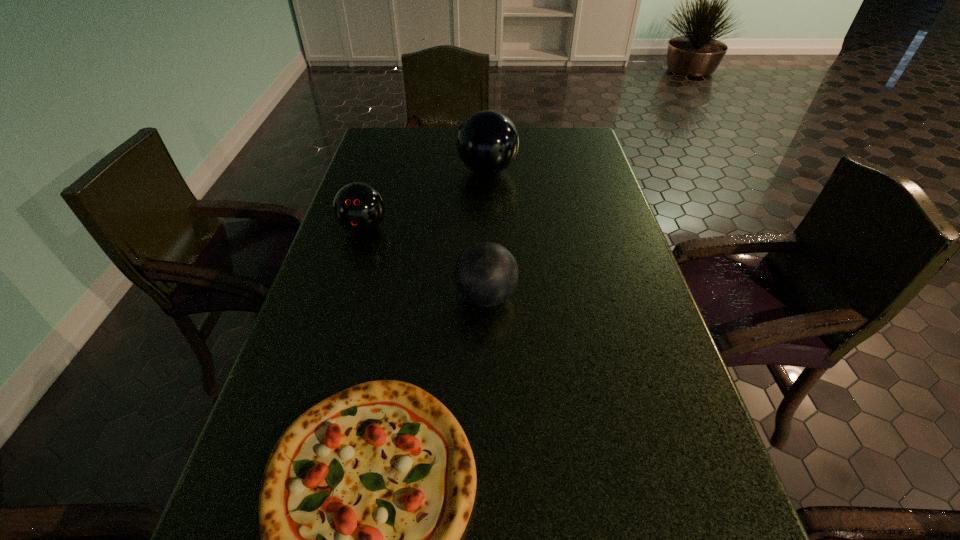
Image resolution: width=960 pixels, height=540 pixels. What are the coordinates of `the tallest bowling ball` in the screenshot? It's located at (487, 143).

Find the location of a particular element. the farthest object is located at coordinates [487, 143].

Find the location of a particular element. the third farthest object is located at coordinates (486, 274).

Locate an element on the screen. Image resolution: width=960 pixels, height=540 pixels. the leftmost bowling ball is located at coordinates (358, 207).

What are the coordinates of `the second farthest object` in the screenshot? It's located at (358, 207).

You are a GUI agent. You are given a task and a screenshot of the screen. Output one action in this format:
    pyautogui.click(x=<x>, y=<y>)
    Task: Click on the vacant point located 0.200m on the side of the farthest object with the finger holes
    
    Given the screenshot: What is the action you would take?
    pyautogui.click(x=394, y=171)

Locate an element on the screen. The width and height of the screenshot is (960, 540). vacant space located on the side of the farthest object with the finger holes is located at coordinates (432, 171).

Where is `free space located 0.160m on the side of the farthest object with the finger holes`? This screenshot has width=960, height=540. free space located 0.160m on the side of the farthest object with the finger holes is located at coordinates (406, 171).

You are a GUI agent. You are given a task and a screenshot of the screen. Output one action in this format:
    pyautogui.click(x=<x>, y=<y>)
    Task: Click on the vacant space positioned on the grip area of the third farthest object
    This screenshot has height=540, width=960.
    Given the screenshot: What is the action you would take?
    pyautogui.click(x=396, y=297)

Where is `vacant space located 0.260m on the grip area of the third farthest object`? This screenshot has width=960, height=540. vacant space located 0.260m on the grip area of the third farthest object is located at coordinates (339, 297).